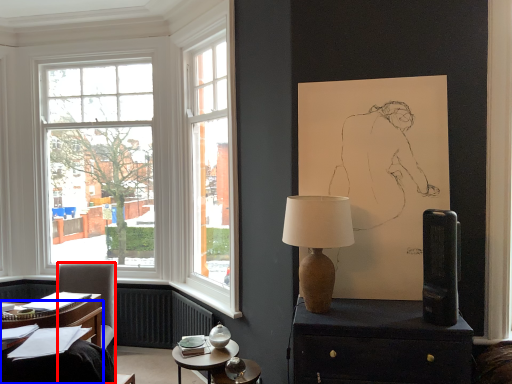
Question: Which of the following is the closest to the observer, chair (highlighted by a red box) or desk (highlighted by a blue box)?

Choices:
 (A) chair
 (B) desk

Answer: (B)